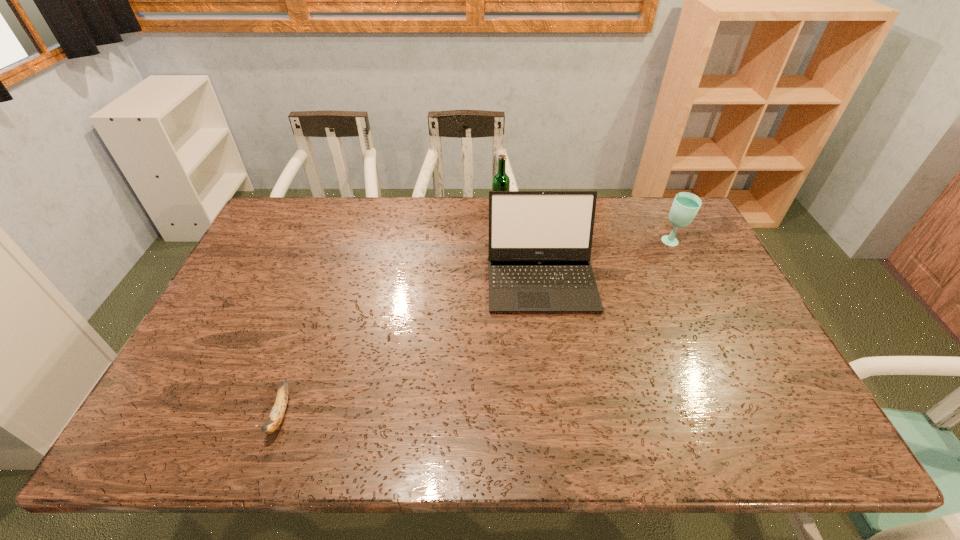
Where is `beer bottle`? beer bottle is located at coordinates (501, 182).

Where is `laptop`? This screenshot has height=540, width=960. laptop is located at coordinates (540, 242).

In order to click on glass in this screenshot , I will do `click(685, 206)`.

Where is `the third tallest object`? Image resolution: width=960 pixels, height=540 pixels. the third tallest object is located at coordinates 685,206.

The image size is (960, 540). I want to click on the nearest object, so click(278, 410).

The image size is (960, 540). What are the coordinates of `the shortest object` in the screenshot? It's located at (278, 410).

You are a GUI agent. You are given a task and a screenshot of the screen. Output one action in this format:
    pyautogui.click(x=<x>, y=<y>)
    Task: Click on the vacant space located on the front of the beer bottle
    
    Given the screenshot: What is the action you would take?
    pyautogui.click(x=501, y=241)

You are a GUI agent. You are given a task and a screenshot of the screen. Output one action in this format:
    pyautogui.click(x=<x>, y=<y>)
    Task: Click on the free region located on the surface of the laptop
    
    Given the screenshot: What is the action you would take?
    pyautogui.click(x=556, y=383)

Where is `vacant point located 0.400m on the left of the glass`? vacant point located 0.400m on the left of the glass is located at coordinates (538, 242).

In order to click on beer bottle at the far edge in this screenshot , I will do `click(501, 182)`.